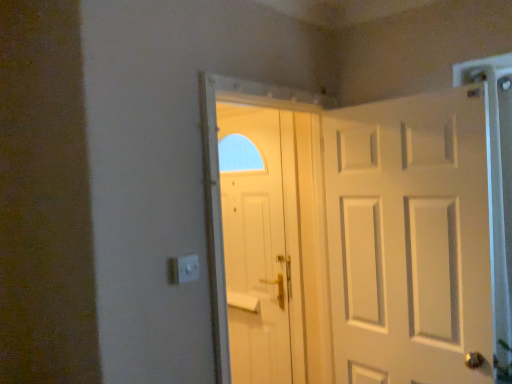
Question: Which direction should I rotate to look at white matte door at center, placed as the first door when sorted from back to front, — up or down?

Choices:
 (A) up
 (B) down

Answer: (B)

Question: Is white matte door at center, placed as the first door when sorted from back to front, to the right of white matte door at right, the first door from the right, from the viewer's perspective?

Choices:
 (A) no
 (B) yes

Answer: (A)

Question: From the image's perspective, would you say white matte door at center, acting as the first door starting from the left, is shown under white matte door at right, which is the 2th door from left to right?

Choices:
 (A) no
 (B) yes

Answer: (B)

Question: Does white matte door at center, which ranks as the second door in right-to-left order, come in front of white matte door at right, the 1th door viewed from the front?

Choices:
 (A) yes
 (B) no

Answer: (B)

Question: Is white matte door at center, acting as the first door starting from the left, wider than white matte door at right, which is the 2th door from left to right?

Choices:
 (A) yes
 (B) no

Answer: (B)

Question: Does white matte door at center, placed as the first door when sorted from back to front, have a lesser width compared to white matte door at right, the 1th door viewed from the front?

Choices:
 (A) yes
 (B) no

Answer: (A)

Question: Is white matte door at right, the 2th door in the back-to-front sequence, smaller than white matte door at center, acting as the first door starting from the left?

Choices:
 (A) yes
 (B) no

Answer: (B)

Question: From a real-world perspective, does white matte door at right, the 2th door in the back-to-front sequence, stand above white matte door at center, acting as the first door starting from the left?

Choices:
 (A) yes
 (B) no

Answer: (A)

Question: From the image's perspective, does white matte door at right, which is the 2th door from left to right, appear higher than white matte door at center, which ranks as the second door in right-to-left order?

Choices:
 (A) yes
 (B) no

Answer: (A)

Question: Is the position of white matte door at right, the 1th door viewed from the front, more distant than that of white matte door at center, which ranks as the second door in right-to-left order?

Choices:
 (A) yes
 (B) no

Answer: (B)

Question: Considering the relative positions of white matte door at right, the 1th door viewed from the front, and white matte door at center, placed as the first door when sorted from back to front, in the image provided, is white matte door at right, the 1th door viewed from the front, to the right of white matte door at center, placed as the first door when sorted from back to front, from the viewer's perspective?

Choices:
 (A) no
 (B) yes

Answer: (B)

Question: Does white matte door at right, which is the 2th door from left to right, have a lesser width compared to white matte door at center, which ranks as the second door in right-to-left order?

Choices:
 (A) yes
 (B) no

Answer: (B)

Question: Is white matte door at center, placed as the first door when sorted from back to front, inside or outside of white matte door at right, which is the 2th door from left to right?

Choices:
 (A) outside
 (B) inside

Answer: (A)